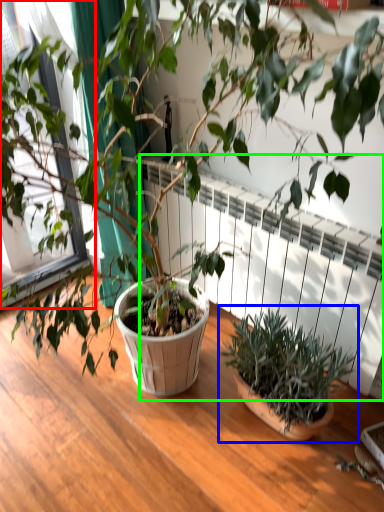
Question: Considering the real-world distances, which object is farthest from window frame (highlighted by a red box)? houseplant (highlighted by a blue box) or radiator (highlighted by a green box)?

Choices:
 (A) houseplant
 (B) radiator

Answer: (A)